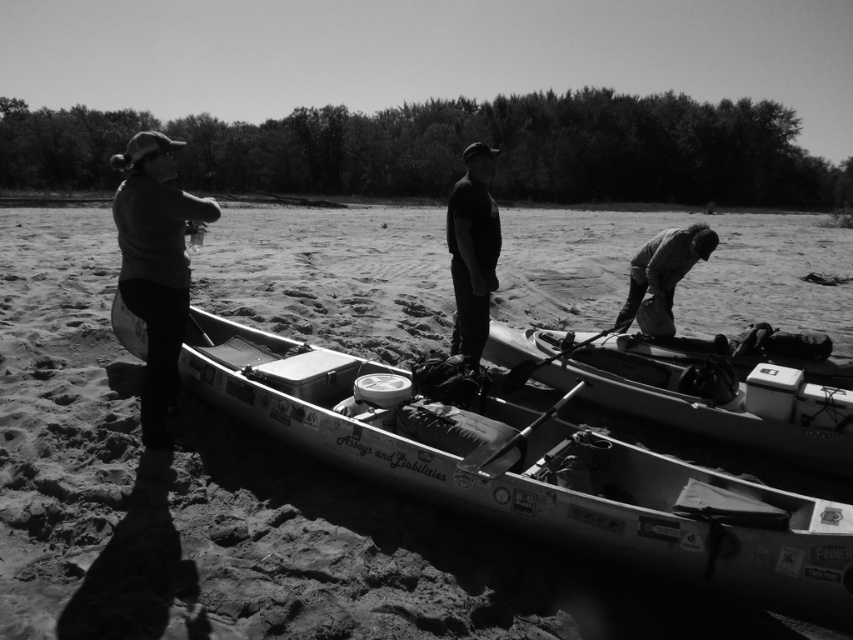
Is metallic kayak at center positioned behind dark gray sweater at left?

No.

Is metallic kayak at center positioned in front of dark gray sweater at left?

Yes, it is.

Between point (128, 310) and point (167, 394), which one is positioned behind?

Point (128, 310)

Find the location of `metallic kayak at center`. metallic kayak at center is located at coordinates (538, 476).

Between point (842, 525) and point (639, 269), which one is positioned behind?

Point (639, 269)

Which is in front, point (293, 408) or point (695, 260)?

Point (293, 408)

Does point (181, 348) come behind point (695, 230)?

No, (181, 348) is closer to viewer.

At what (x,y) coordinates should I click in order to perform the action: click on metallic kayak at center. Please return your answer as a coordinate pair (x, y). This screenshot has height=640, width=853. Looking at the image, I should click on (538, 476).

The height and width of the screenshot is (640, 853). What do you see at coordinates (718, 403) in the screenshot?
I see `smooth plastic canoe at center` at bounding box center [718, 403].

Which of these two, smooth plastic canoe at center or dark fabric jacket at lower right, stands shorter?

Standing shorter between the two is dark fabric jacket at lower right.

The height and width of the screenshot is (640, 853). I want to click on smooth plastic canoe at center, so click(718, 403).